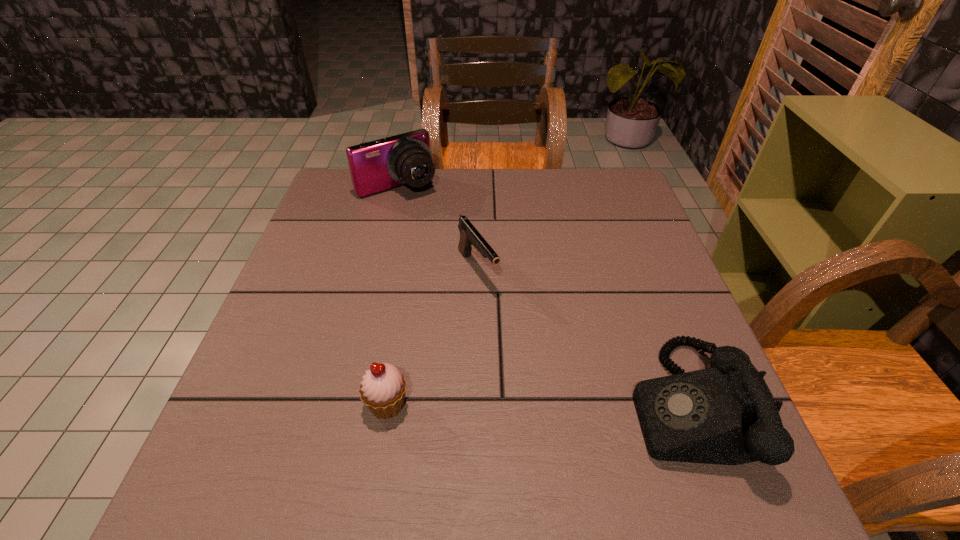
The height and width of the screenshot is (540, 960). In order to click on cupcake in this screenshot , I will do `click(383, 388)`.

At what (x,y) coordinates should I click in order to perform the action: click on telephone. Please return your answer as a coordinate pair (x, y). Looking at the image, I should click on (726, 414).

You are a GUI agent. You are given a task and a screenshot of the screen. Output one action in this format:
    pyautogui.click(x=<x>, y=<y>)
    Task: Click on the pistol
    The image size is (960, 540).
    Given the screenshot: What is the action you would take?
    pyautogui.click(x=470, y=238)

What are the coordinates of `the third object from left to right` in the screenshot? It's located at (470, 238).

This screenshot has width=960, height=540. In order to click on camera in this screenshot , I will do `click(375, 166)`.

At what (x,y) coordinates should I click in order to perform the action: click on vacant space located 0.350m on the right of the cupcake. Please return your answer as a coordinate pair (x, y). This screenshot has width=960, height=540. Looking at the image, I should click on (604, 404).

Locate an element on the screen. vacant space located on the dial of the rightmost object is located at coordinates (461, 404).

Where is `vacant space located 0.240m on the dial of the rightmost object`? This screenshot has height=540, width=960. vacant space located 0.240m on the dial of the rightmost object is located at coordinates (500, 404).

At what (x,y) coordinates should I click in order to perform the action: click on free space located on the dial of the rightmost object. Please return your answer as a coordinate pair (x, y). The image size is (960, 540). Looking at the image, I should click on (505, 404).

The width and height of the screenshot is (960, 540). I want to click on free location located 0.260m at the muzzle of the second farthest object, so click(552, 380).